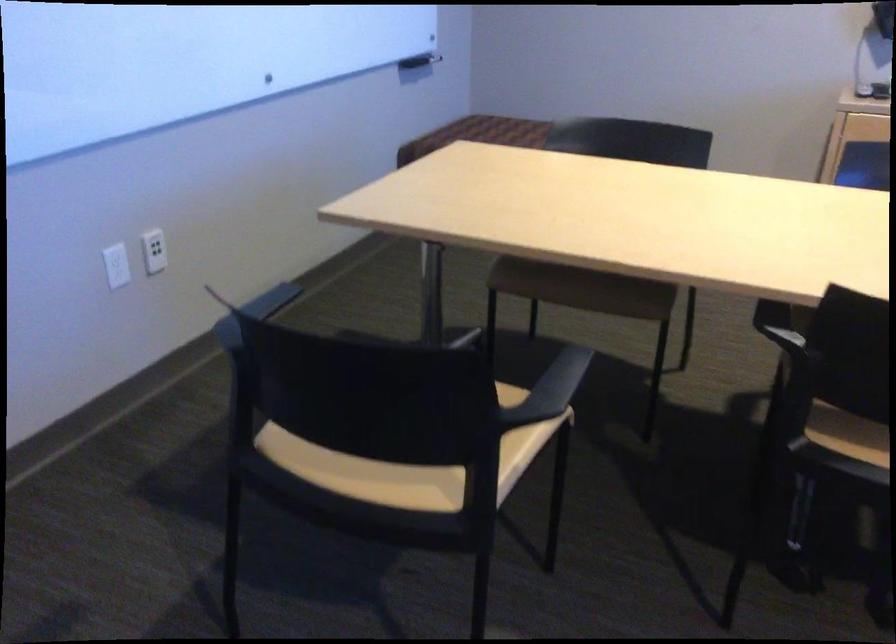
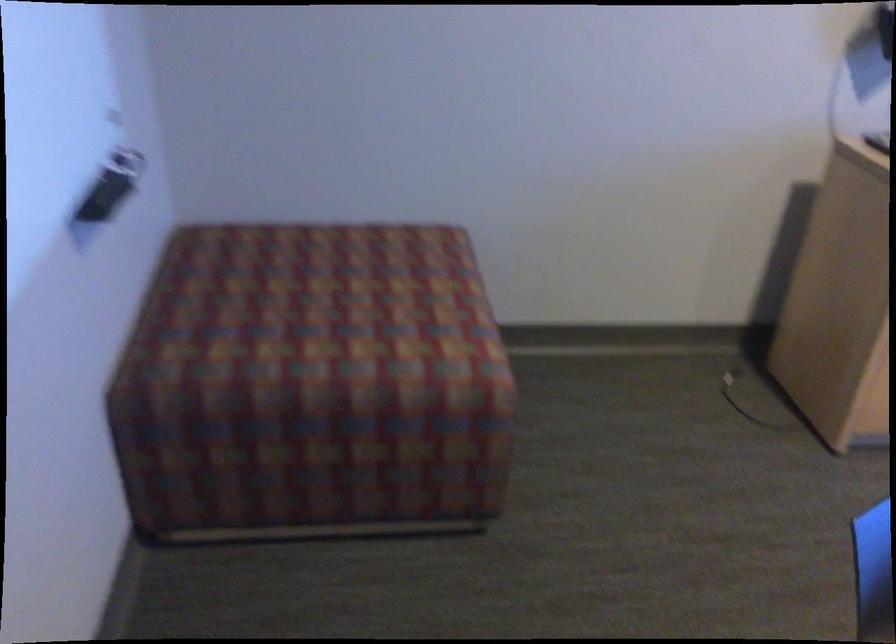
In the second image, find the point that corresponds to point (514, 134) in the first image.

(332, 301)